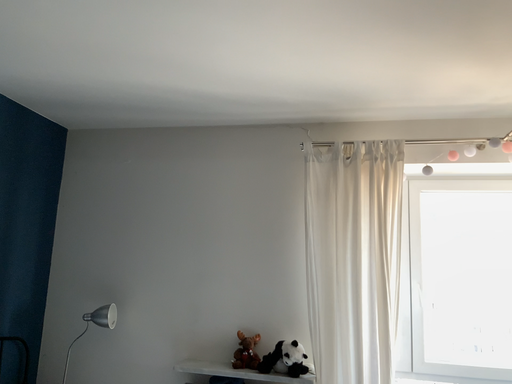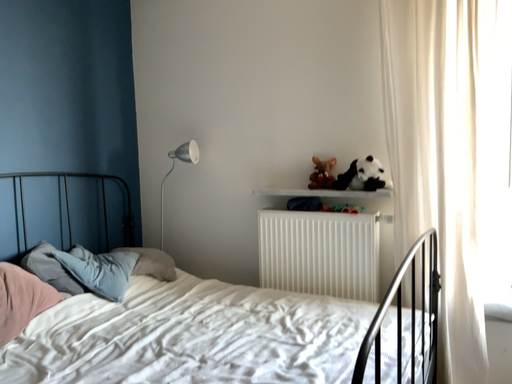
Question: How did the camera likely rotate when shooting the video?

Choices:
 (A) rotated right
 (B) rotated left

Answer: (B)